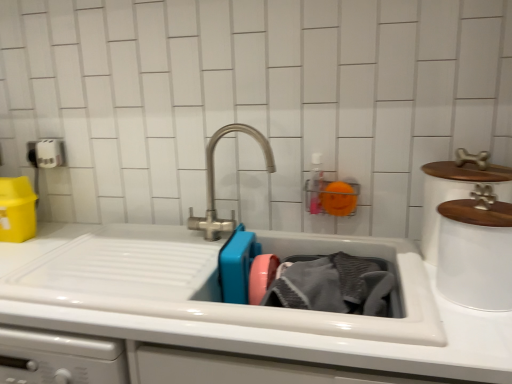
Locate an element on the screen. free space in front of satin nickel faucet at center is located at coordinates (200, 266).